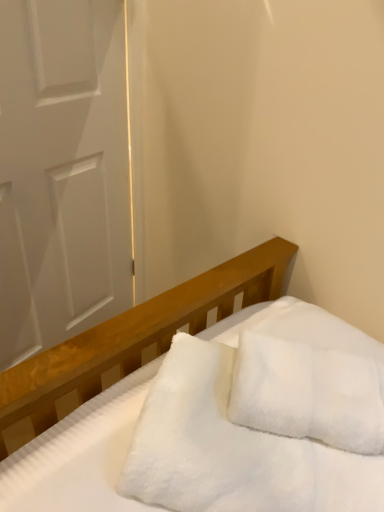
Question: Is white fluffy pillow at center thinner than white matte door at left?

Choices:
 (A) yes
 (B) no

Answer: (B)

Question: Does white fluffy pillow at center have a larger size compared to white matte door at left?

Choices:
 (A) no
 (B) yes

Answer: (A)

Question: Does white fluffy pillow at center have a lesser height compared to white matte door at left?

Choices:
 (A) yes
 (B) no

Answer: (A)

Question: Does white fluffy pillow at center have a smaller size compared to white matte door at left?

Choices:
 (A) no
 (B) yes

Answer: (B)

Question: From a real-world perspective, does white fluffy pillow at center stand above white matte door at left?

Choices:
 (A) no
 (B) yes

Answer: (B)

Question: Is white fluffy blanket at center spatially inside white matte door at left, or outside of it?

Choices:
 (A) inside
 (B) outside

Answer: (B)

Question: From a real-world perspective, is white fluffy blanket at center physically located above or below white matte door at left?

Choices:
 (A) above
 (B) below

Answer: (A)

Question: Looking at their shapes, would you say white fluffy blanket at center is wider or thinner than white matte door at left?

Choices:
 (A) wide
 (B) thin

Answer: (A)

Question: Is point (x=354, y=455) closer or farther from the camera than point (x=92, y=260)?

Choices:
 (A) farther
 (B) closer

Answer: (B)

Question: In terms of size, does white fluffy pillow at center appear bigger or smaller than white matte door at left?

Choices:
 (A) big
 (B) small

Answer: (B)

Question: In the image, is white fluffy pillow at center positioned in front of or behind white matte door at left?

Choices:
 (A) behind
 (B) front

Answer: (B)

Question: From the image's perspective, is white fluffy pillow at center positioned above or below white matte door at left?

Choices:
 (A) below
 (B) above

Answer: (A)

Question: From their relative heights in the image, would you say white fluffy pillow at center is taller or shorter than white matte door at left?

Choices:
 (A) short
 (B) tall

Answer: (A)

Question: Considering the positions of white matte door at left and white fluffy blanket at center in the image, is white matte door at left wider or thinner than white fluffy blanket at center?

Choices:
 (A) wide
 (B) thin

Answer: (B)

Question: In terms of size, does white matte door at left appear bigger or smaller than white fluffy blanket at center?

Choices:
 (A) small
 (B) big

Answer: (B)